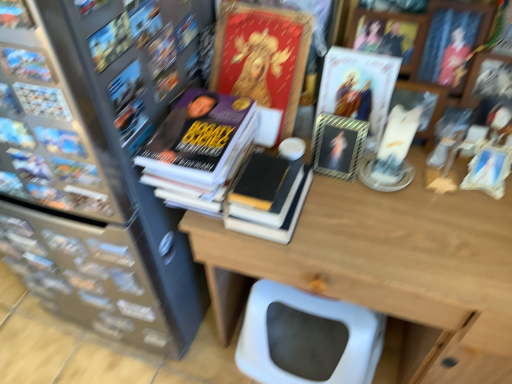
Locate an element on the screen. The width and height of the screenshot is (512, 384). unoccupied region to the right of hardcover book at center, arranged as the third book when viewed from the front is located at coordinates (358, 223).